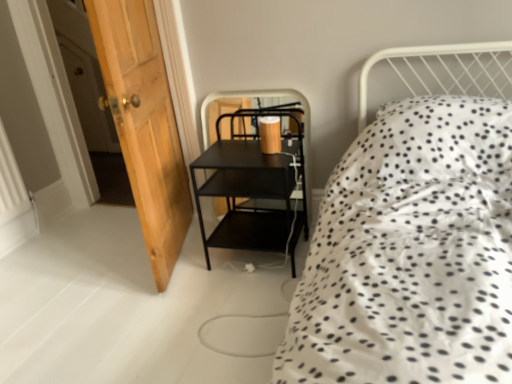
The width and height of the screenshot is (512, 384). What do you see at coordinates (144, 125) in the screenshot? I see `wooden door at left` at bounding box center [144, 125].

Image resolution: width=512 pixels, height=384 pixels. Identify the location of wooden door at left. (144, 125).

Identify the location of black metal shelf at center. (254, 187).

Describe the element at coordinates (254, 187) in the screenshot. I see `black metal shelf at center` at that location.

Where is `wooden door at left`? wooden door at left is located at coordinates coord(144,125).

In the image, is wooden door at left on the left side or the right side of black metal shelf at center?

wooden door at left is to the left of black metal shelf at center.

Which object is further away from the camera taking this photo, wooden door at left or black metal shelf at center?

black metal shelf at center is behind.

Which is closer, (111, 76) or (283, 179)?

Point (111, 76) appears to be closer to the viewer than point (283, 179).

From the image's perspective, is wooden door at left above or below black metal shelf at center?

Clearly, from the image's perspective, wooden door at left is above black metal shelf at center.

From a real-world perspective, relative to black metal shelf at center, is wooden door at left vertically above or below?

In terms of real-world spatial position, wooden door at left is above black metal shelf at center.

Considering the relative sizes of wooden door at left and black metal shelf at center in the image provided, is wooden door at left wider than black metal shelf at center?

Yes, wooden door at left is wider than black metal shelf at center.

Who is taller, wooden door at left or black metal shelf at center?

Standing taller between the two is wooden door at left.

Between wooden door at left and black metal shelf at center, which one has larger size?

With larger size is wooden door at left.

Is wooden door at left inside or outside of black metal shelf at center?

The correct answer is: outside.

Is wooden door at left far away from black metal shelf at center?

wooden door at left is near black metal shelf at center, not far away.

Is wooden door at left turned away from black metal shelf at center?

No.

Measure the distance from wooden door at left to black metal shelf at center.

wooden door at left is 15.68 inches from black metal shelf at center.

Find the location of a particular element. The width and height of the screenshot is (512, 384). door above the black metal shelf at center (from the image's perspective) is located at coordinates (144, 125).

Considering the positions of objects black metal shelf at center and wooden door at left in the image provided, who is more to the right, black metal shelf at center or wooden door at left?

black metal shelf at center.

Is black metal shelf at center behind wooden door at left?

Yes, black metal shelf at center is further from the camera.

Is point (280, 242) closer to camera compared to point (142, 225)?

No, (280, 242) is further to viewer.

Consider the image. From the image's perspective, which is below, black metal shelf at center or wooden door at left?

black metal shelf at center is shown below in the image.

From a real-world perspective, which is physically below, black metal shelf at center or wooden door at left?

black metal shelf at center, from a real-world perspective.

Which of these two, black metal shelf at center or wooden door at left, is thinner?

black metal shelf at center is thinner.

Who is taller, black metal shelf at center or wooden door at left?

wooden door at left.

Who is smaller, black metal shelf at center or wooden door at left?

With smaller size is black metal shelf at center.

Is black metal shelf at center spatially inside wooden door at left, or outside of it?

black metal shelf at center cannot be found inside wooden door at left.

Is black metal shelf at center beside wooden door at left?

black metal shelf at center is not next to wooden door at left, and they're not touching.

Could you tell me if black metal shelf at center is turned towards wooden door at left?

No, black metal shelf at center is not oriented towards wooden door at left.

How far apart are black metal shelf at center and wooden door at left?

They are 39.84 centimeters apart.

You are a GUI agent. You are given a task and a screenshot of the screen. Output one action in this format:
    pyautogui.click(x=<x>, y=<y>)
    Task: Click on the shelf on the right of the wooden door at left
    This screenshot has width=512, height=384.
    Given the screenshot: What is the action you would take?
    pyautogui.click(x=254, y=187)

This screenshot has width=512, height=384. Find the location of `shelf on the right of wooden door at left`. shelf on the right of wooden door at left is located at coordinates (254, 187).

Identify the location of shelf behind the wooden door at left. The width and height of the screenshot is (512, 384). (254, 187).